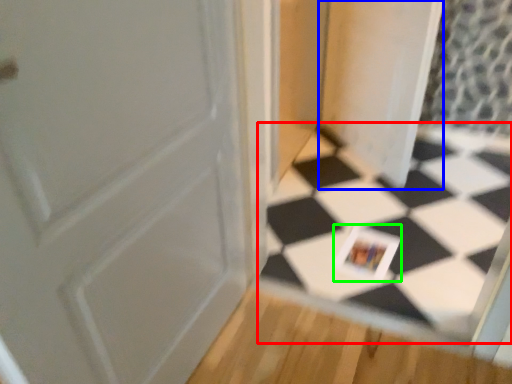
Question: Which is farther away from square (highlighted by a red box)? screen door (highlighted by a blue box) or postcard (highlighted by a green box)?

Choices:
 (A) screen door
 (B) postcard

Answer: (A)